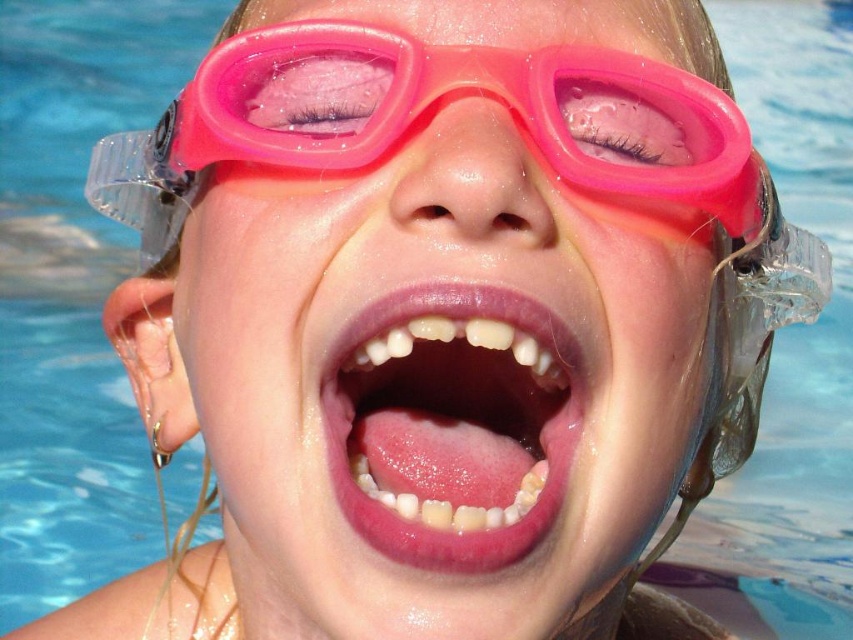
You are a photographer adjusting your camera focus. You need to focus on both the point at coordinates point (721, 108) and the point at coordinates point (358, 406). Since the camera can only focus on one depth at a time, which point should you prioritize focusing on to ensure the closer object is sharp?

Point (721, 108) is closer to the viewer than point (358, 406), so you should prioritize focusing on point (721, 108) to ensure the closer object is sharp.

You are a photographer trying to focus on the pink rubber goggles at center in the image. The camera shows a grid with a point at coordinate (419, 116). Is this point located on the pink rubber goggles at center?

Yes, the point at coordinate (419, 116) corresponds to the pink rubber goggles at center, so the point is located on them.